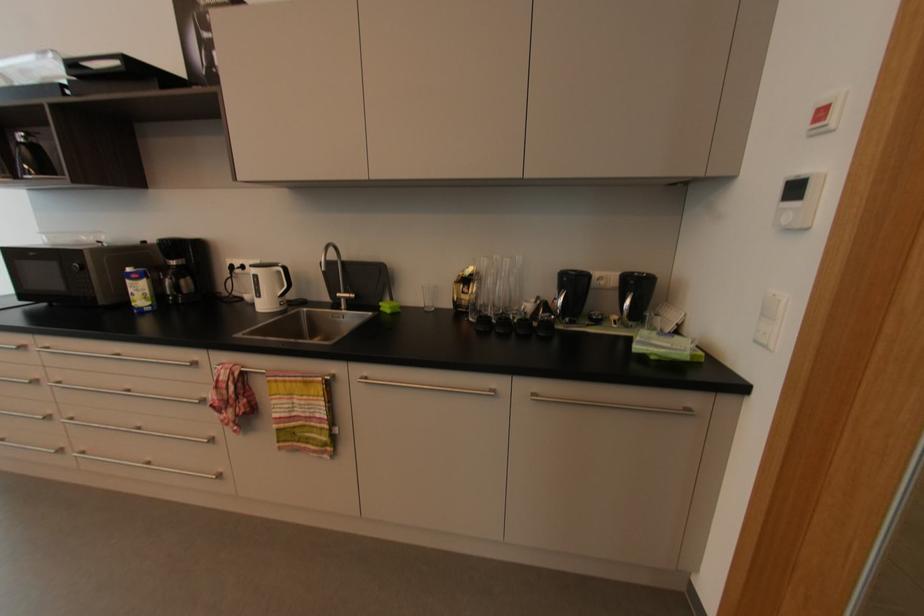
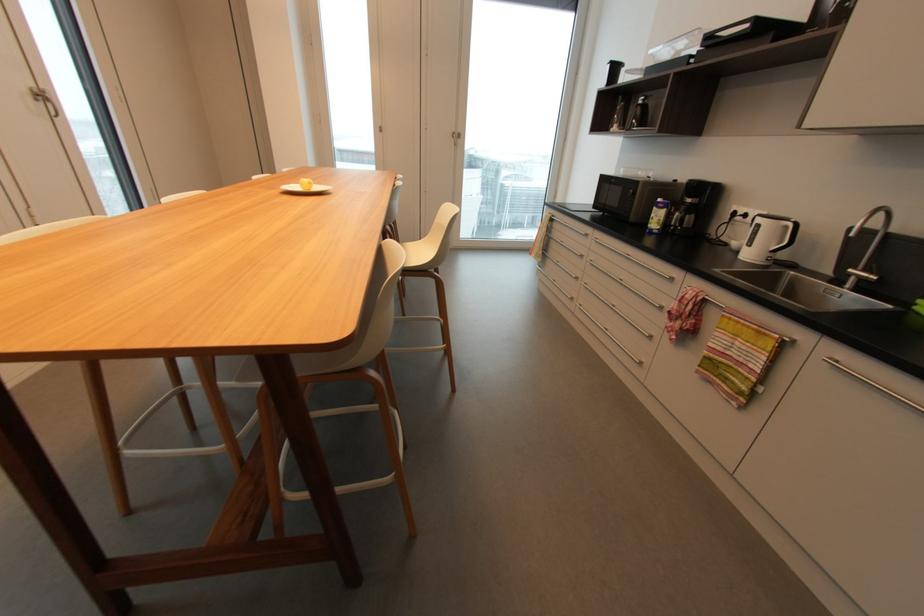
Find the pixel in the second image that matches (282,273) in the first image.

(789, 227)